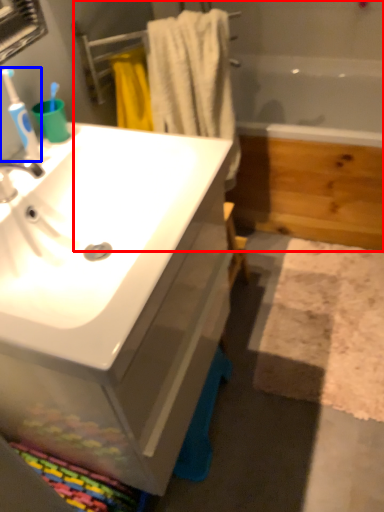
Question: Which of the following is the closest to the observer, bath (highlighted by a red box) or toothbrush (highlighted by a blue box)?

Choices:
 (A) bath
 (B) toothbrush

Answer: (B)